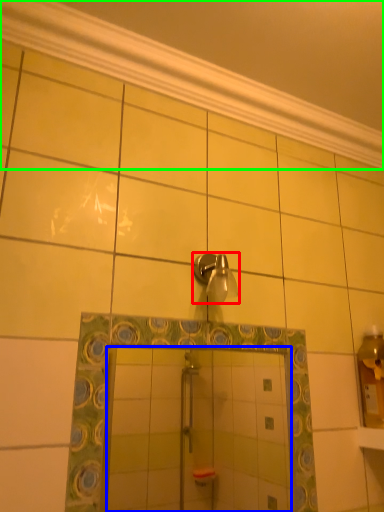
Question: Estimate the real-world distances between objects in this image. Which object is closer to shower (highlighted by a red box), mirror (highlighted by a blue box) or molding (highlighted by a green box)?

Choices:
 (A) mirror
 (B) molding

Answer: (B)